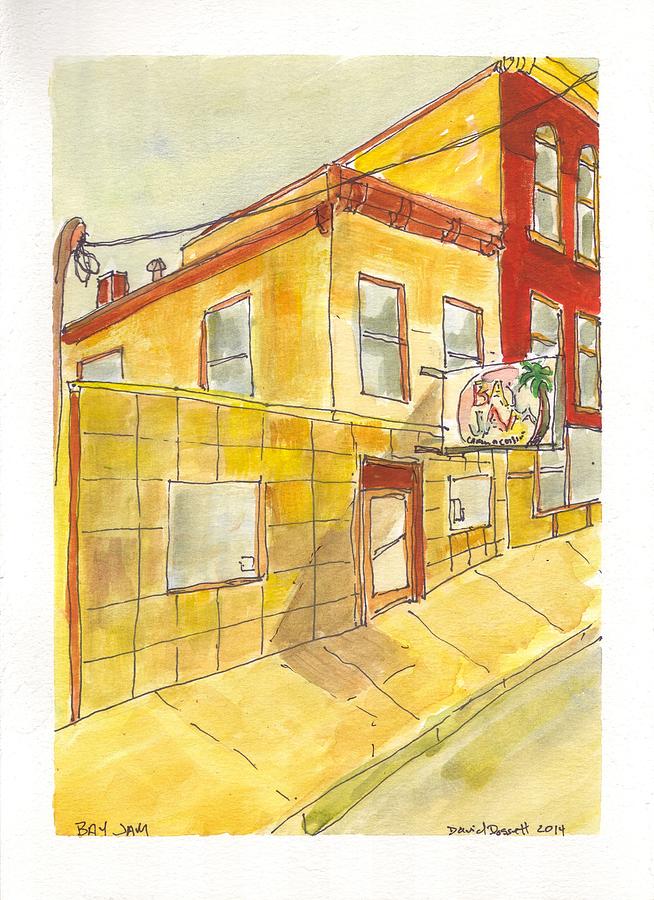
Identify the location of the closest window. (228, 536).